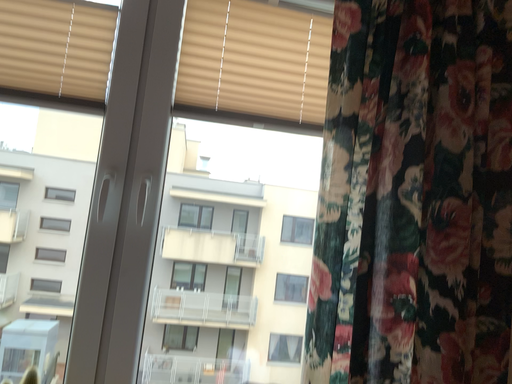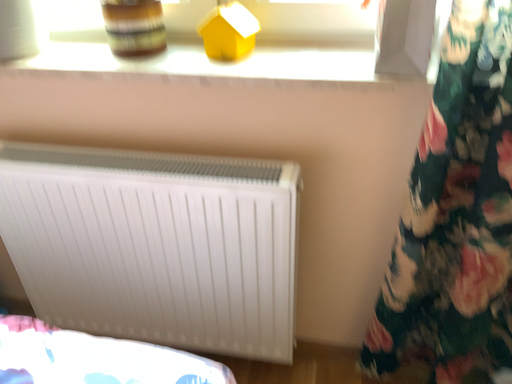
Question: How did the camera likely rotate when shooting the video?

Choices:
 (A) rotated upward
 (B) rotated downward

Answer: (B)